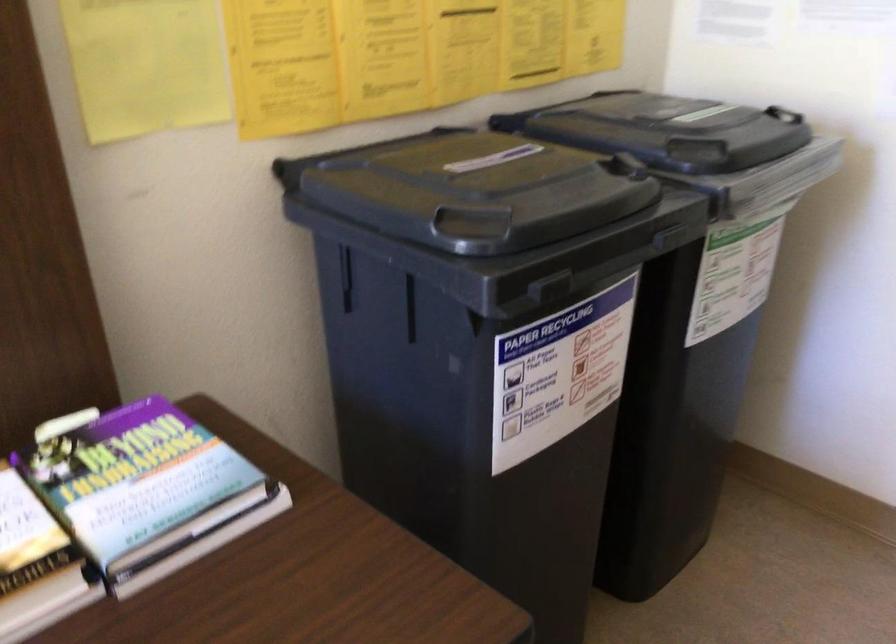
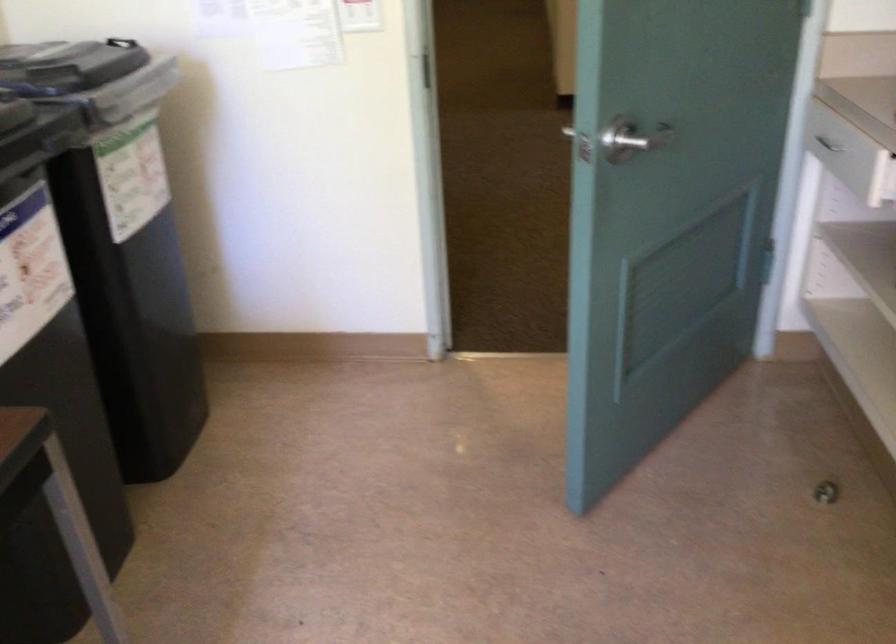
Locate, in the second image, the point that corresponds to the point at 693,140 in the first image.

(66, 64)